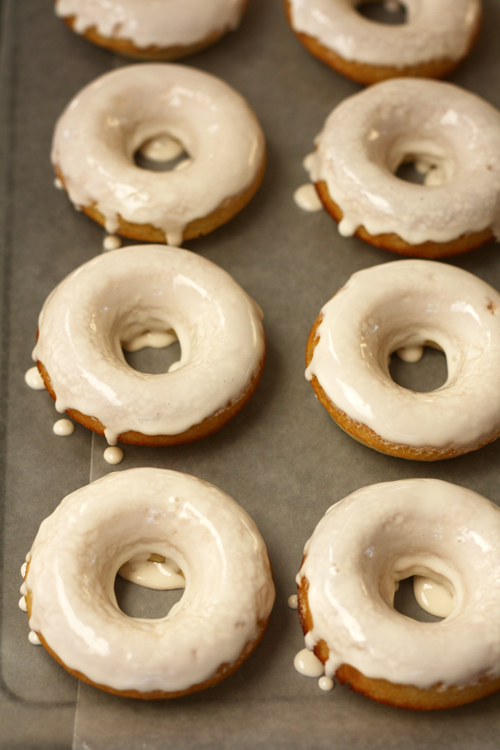
The width and height of the screenshot is (500, 750). I want to click on baking sheet, so click(44, 452).